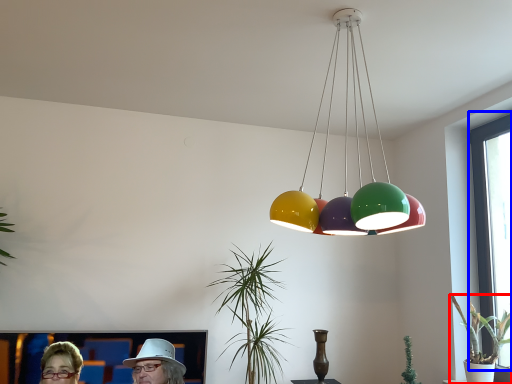
Question: Which object appears farthest to the camera in this image, houseplant (highlighted by a red box) or window screen (highlighted by a blue box)?

Choices:
 (A) houseplant
 (B) window screen

Answer: (B)